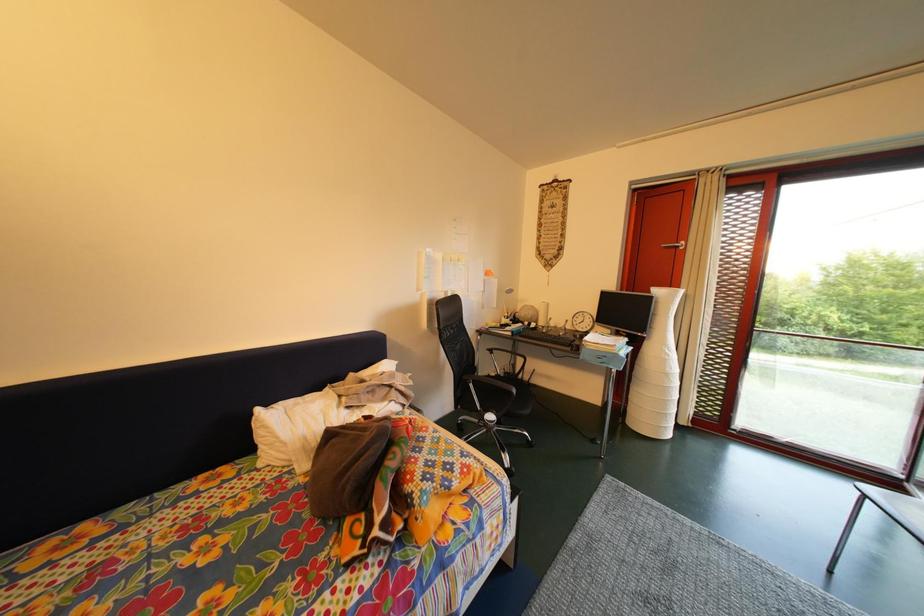
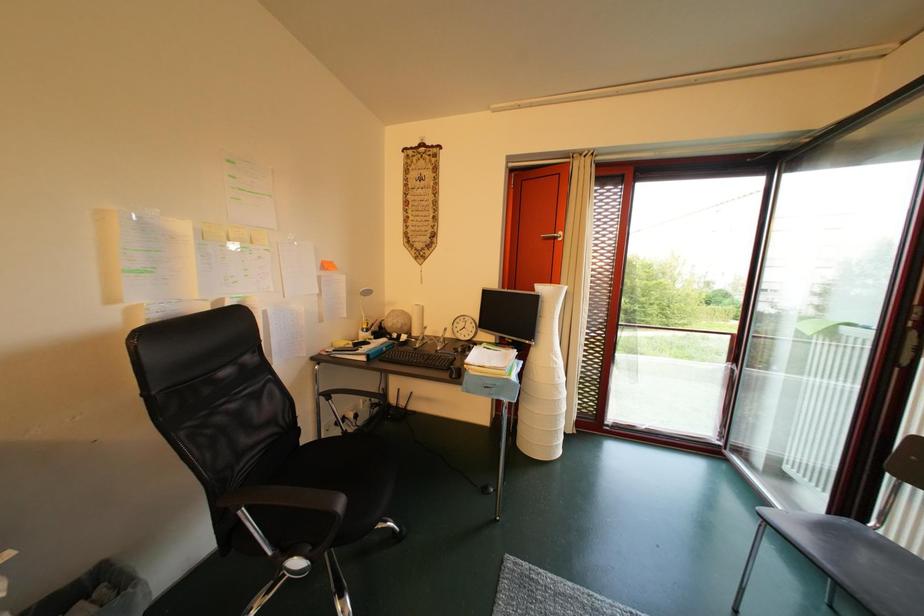
Question: Based on the continuous images, in which direction is the camera rotating? Reply with the corresponding letter.

Choices:
 (A) Left
 (B) Right
 (C) Up
 (D) Down

Answer: (B)